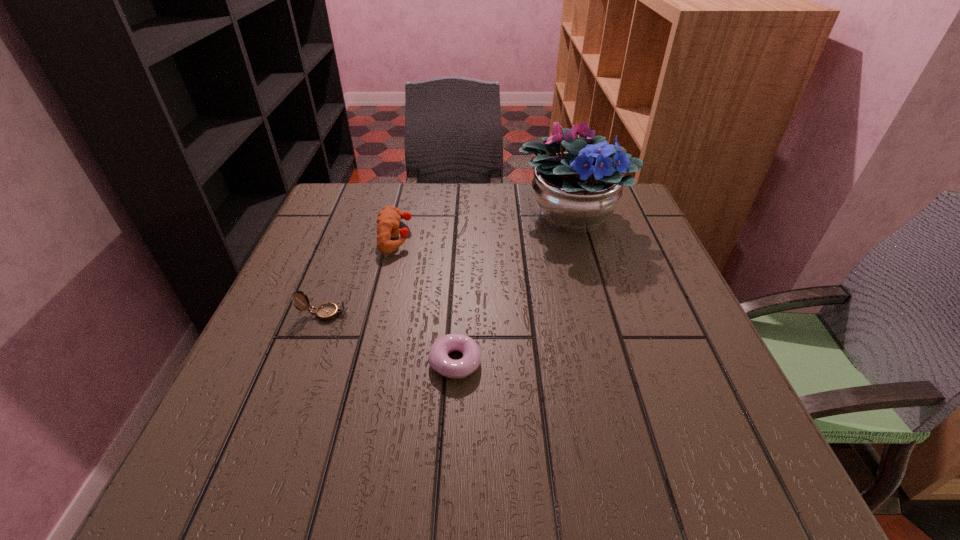
You are a GUI agent. You are given a task and a screenshot of the screen. Output one action in this format:
    pyautogui.click(x=<x>, y=<y>)
    Task: Click on the vacant area that lies between the third object from right to left and the third farthest object
    The height and width of the screenshot is (540, 960).
    Given the screenshot: What is the action you would take?
    pyautogui.click(x=360, y=275)

This screenshot has width=960, height=540. Find the location of `unoccupied position between the second nearest object and the puncher`. unoccupied position between the second nearest object and the puncher is located at coordinates (360, 275).

In order to click on free space that is in between the compass and the doughnut in this screenshot , I will do `click(390, 338)`.

Locate which object ranks second in proximity to the rightmost object. Please provide its 2D coordinates. Your answer should be formatted as a tuple, i.e. [(x, y)], where the tuple contains the x and y coordinates of a point satisfying the conditions above.

[(439, 360)]

Select which object appears as the third closest to the third shortest object. Please provide its 2D coordinates. Your answer should be formatted as a tuple, i.e. [(x, y)], where the tuple contains the x and y coordinates of a point satisfying the conditions above.

[(576, 191)]

At what (x,y) coordinates should I click in order to perform the action: click on free region that satisfies the following two spatial constraints: 1. on the face of the third object from left to right; 2. on the right side of the leftmost object. Please return your answer as a coordinate pair (x, y). Looking at the image, I should click on (306, 362).

Locate an element on the screen. vacant region that satisfies the following two spatial constraints: 1. on the face of the second shortest object; 2. on the left side of the doughnut is located at coordinates (306, 362).

You are a GUI agent. You are given a task and a screenshot of the screen. Output one action in this format:
    pyautogui.click(x=<x>, y=<y>)
    Task: Click on the vacant area in the image that satisfies the following two spatial constraints: 1. on the back side of the doughnut; 2. with the gloves of the second tallest object facing forward
    
    Given the screenshot: What is the action you would take?
    pyautogui.click(x=462, y=237)

Locate an element on the screen. free space that satisfies the following two spatial constraints: 1. with the gloves of the puncher facing forward; 2. on the left side of the doughnut is located at coordinates (366, 362).

The width and height of the screenshot is (960, 540). Find the location of `free region that satisfies the following two spatial constraints: 1. on the front side of the rightmost object; 2. on the face of the second nearest object`. free region that satisfies the following two spatial constraints: 1. on the front side of the rightmost object; 2. on the face of the second nearest object is located at coordinates (599, 314).